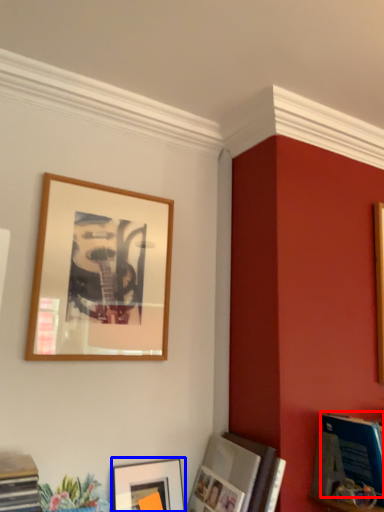
Question: Which object appears closest to the camera in this image, magazine (highlighted by a red box) or picture frame (highlighted by a blue box)?

Choices:
 (A) magazine
 (B) picture frame

Answer: (A)